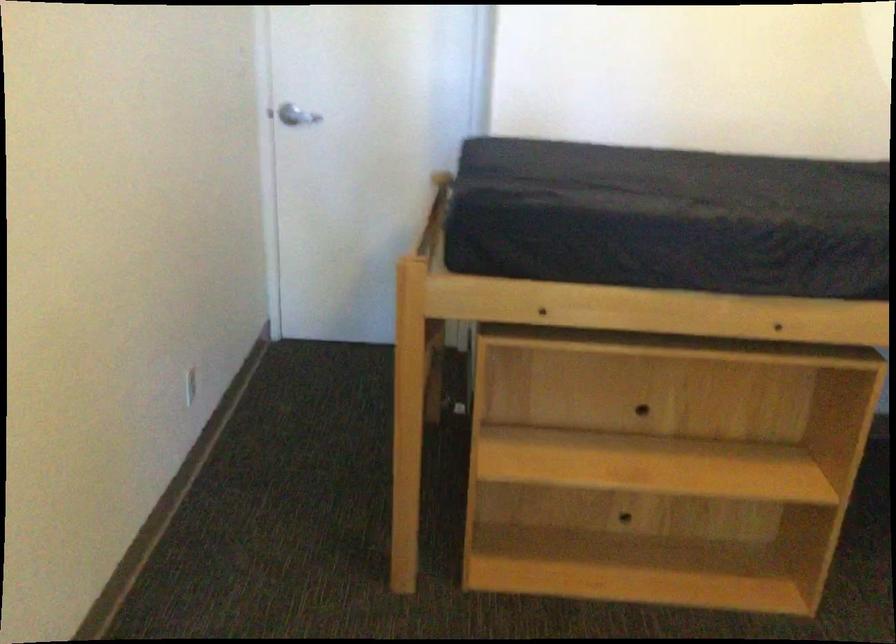
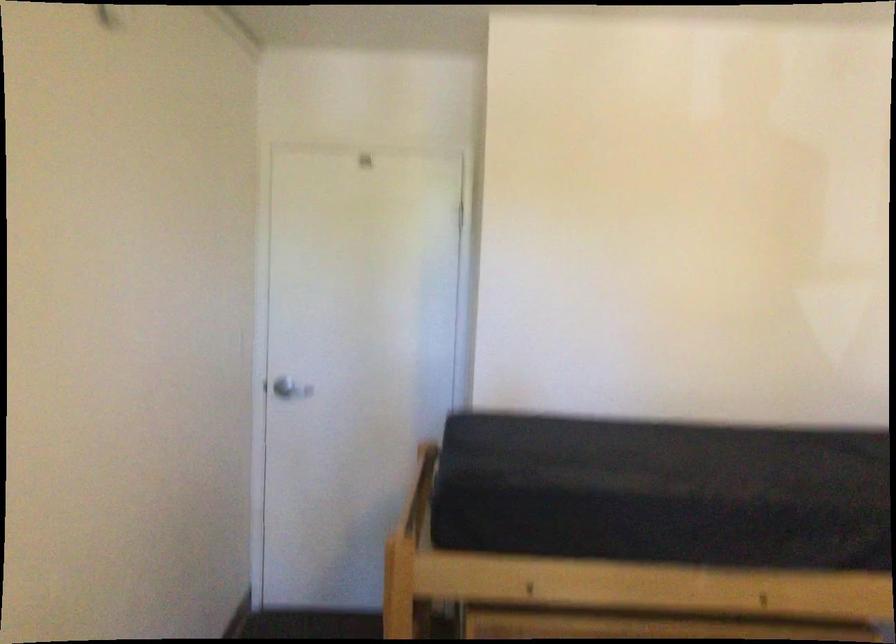
Question: The first image is from the beginning of the video and the second image is from the end. How did the camera likely rotate when shooting the video?

Choices:
 (A) Left
 (B) Right
 (C) Up
 (D) Down

Answer: (C)